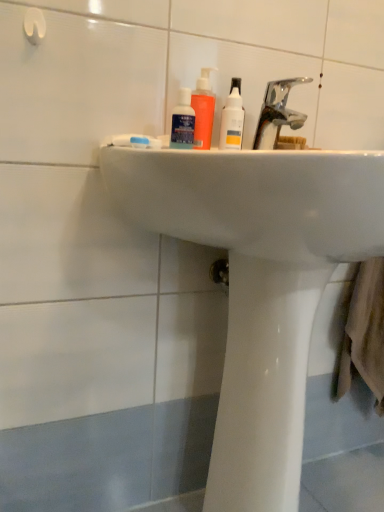
Question: From the image's perspective, is blue matte toothpaste at center above or below matte black mouthwash at center, which ranks as the second mouthwash in back-to-front order?

Choices:
 (A) above
 (B) below

Answer: (B)

Question: Looking at their shapes, would you say blue matte toothpaste at center is wider or thinner than matte black mouthwash at center, which ranks as the second mouthwash in back-to-front order?

Choices:
 (A) thin
 (B) wide

Answer: (A)

Question: Considering the real-world distances, which object is closest to the translucent orange bottle at center, arranged as the first mouthwash when viewed from the back?

Choices:
 (A) metallic chrome faucet at upper center
 (B) white glossy bidet at lower center
 (C) matte black mouthwash at center, which is the 1th mouthwash in front-to-back order
 (D) blue matte toothpaste at center
 (E) white glossy bottle at upper center

Answer: (C)

Question: Based on their relative distances, which object is nearer to the translucent orange bottle at center, arranged as the first mouthwash when viewed from the back?

Choices:
 (A) metallic chrome faucet at upper center
 (B) white glossy bidet at lower center
 (C) white glossy sink at center
 (D) white glossy bottle at upper center
 (E) matte black mouthwash at center, which is the 1th mouthwash in front-to-back order

Answer: (E)